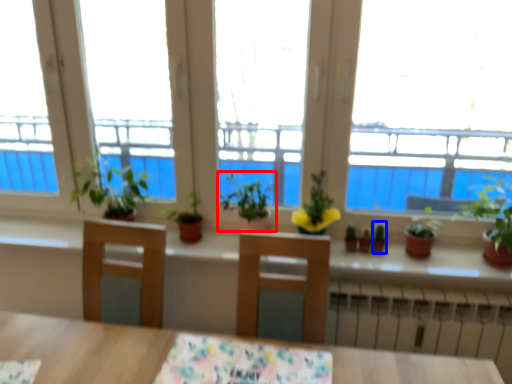
Question: Which point is closer to the camera, houseplant (highlighted by a red box) or plant (highlighted by a blue box)?

Choices:
 (A) houseplant
 (B) plant

Answer: (A)